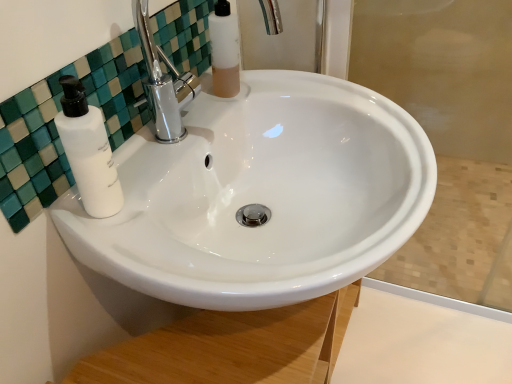
What are the coordinates of `vacant area that is in front of translucent plastic mouthwash at upper center` in the screenshot? It's located at (205, 127).